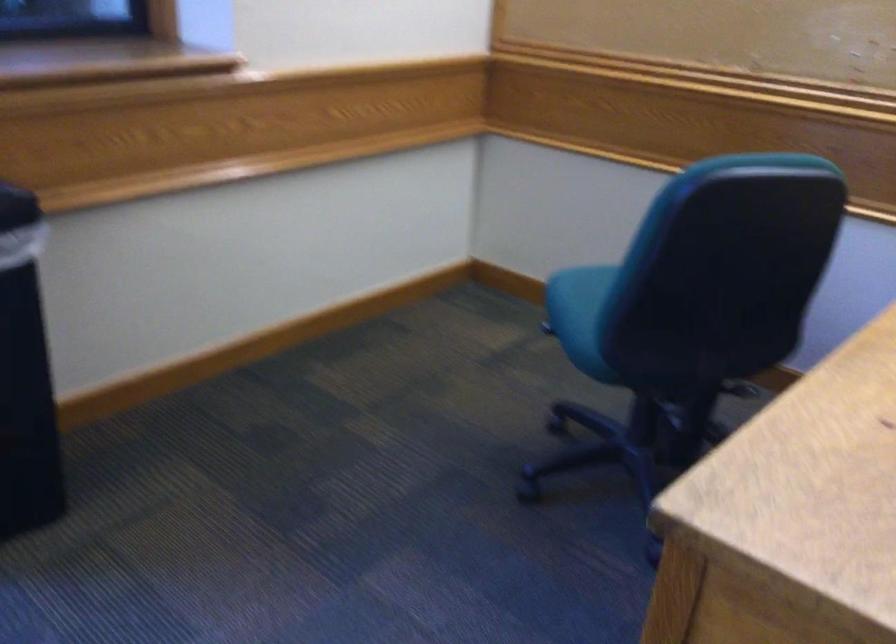
Find the location of `chair sitting surface`. chair sitting surface is located at coordinates (581, 315).